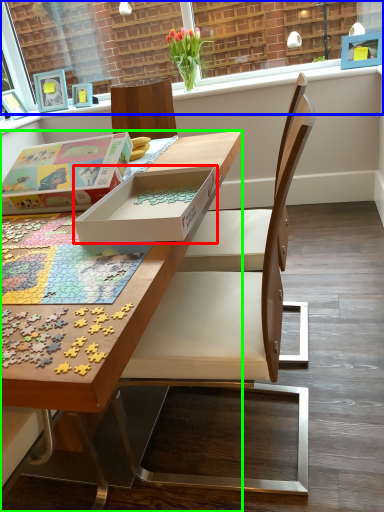
Question: Which is farther away from box (highlighted by a red box)? window frame (highlighted by a blue box) or desk (highlighted by a green box)?

Choices:
 (A) window frame
 (B) desk

Answer: (A)